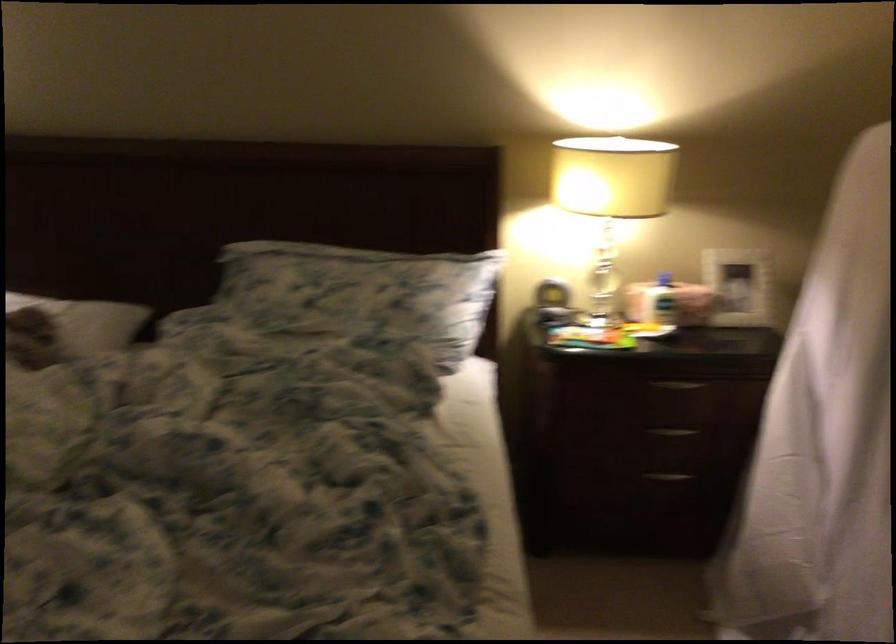
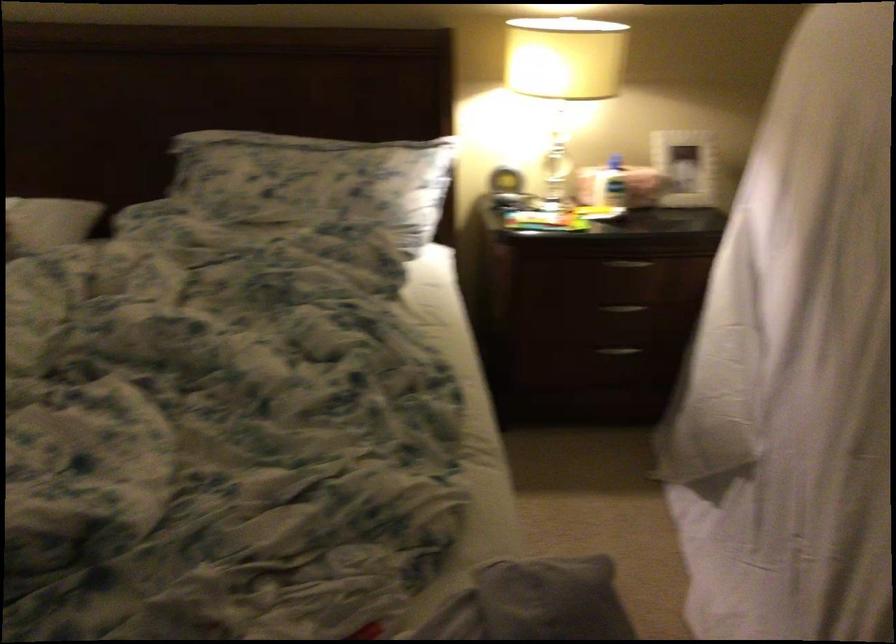
Where in the second image is the point corresponding to the point at 679,386 from the first image?

(627, 263)